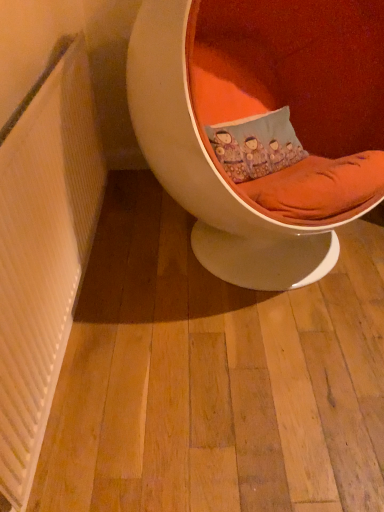
What do you see at coordinates (262, 126) in the screenshot?
I see `white glossy pod chair at center` at bounding box center [262, 126].

In order to face white glossy pod chair at center, should I rotate leftwards or rightwards?

Turn right by 10.283 degrees to look at white glossy pod chair at center.

I want to click on white glossy pod chair at center, so click(x=262, y=126).

At what (x,y) coordinates should I click in order to perform the action: click on white glossy pod chair at center. Please return your answer as a coordinate pair (x, y). Looking at the image, I should click on (262, 126).